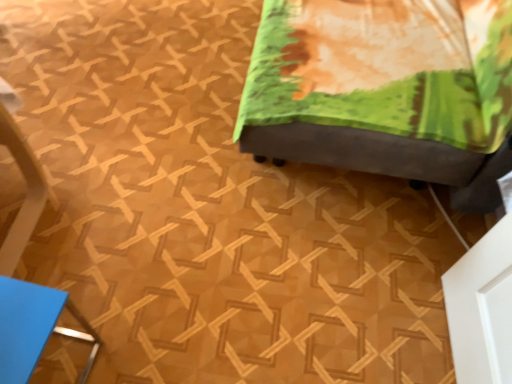
At what (x,y) coordinates should I click in order to perform the action: click on free space between blue matte folder at lower left, the 1th furniture when ordered from left to right, and velvet green ottoman at center, which appears as the second furniture when viewed from the left. Please return your answer as a coordinate pair (x, y). Looking at the image, I should click on (217, 223).